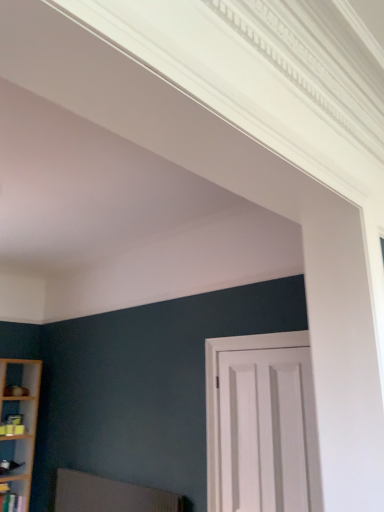
Question: Is white matte door at center at the left side of textured fabric swivel chair at lower left?

Choices:
 (A) no
 (B) yes

Answer: (A)

Question: Does white matte door at center have a lesser width compared to textured fabric swivel chair at lower left?

Choices:
 (A) yes
 (B) no

Answer: (A)

Question: Can you confirm if white matte door at center is wider than textured fabric swivel chair at lower left?

Choices:
 (A) no
 (B) yes

Answer: (A)

Question: Is white matte door at center turned away from textured fabric swivel chair at lower left?

Choices:
 (A) no
 (B) yes

Answer: (A)

Question: Is textured fabric swivel chair at lower left completely or partially inside white matte door at center?

Choices:
 (A) no
 (B) yes

Answer: (A)

Question: In the image, is white matte door at center positioned in front of or behind wooden shelf at lower left?

Choices:
 (A) front
 (B) behind

Answer: (A)

Question: Is point (233, 394) closer or farther from the camera than point (13, 494)?

Choices:
 (A) farther
 (B) closer

Answer: (B)

Question: Is white matte door at center taller or shorter than wooden shelf at lower left?

Choices:
 (A) short
 (B) tall

Answer: (B)

Question: Is white matte door at center to the left or to the right of wooden shelf at lower left in the image?

Choices:
 (A) right
 (B) left

Answer: (A)

Question: Relative to white matte door at center, is textured fabric swivel chair at lower left in front or behind?

Choices:
 (A) behind
 (B) front

Answer: (A)

Question: Looking at the image, does textured fabric swivel chair at lower left seem bigger or smaller compared to white matte door at center?

Choices:
 (A) big
 (B) small

Answer: (A)

Question: Considering the relative positions of textured fabric swivel chair at lower left and white matte door at center in the image provided, is textured fabric swivel chair at lower left to the left or to the right of white matte door at center?

Choices:
 (A) left
 (B) right

Answer: (A)

Question: From a real-world perspective, is textured fabric swivel chair at lower left positioned above or below white matte door at center?

Choices:
 (A) below
 (B) above

Answer: (A)

Question: Based on their positions, is white matte door at center located to the left or right of textured fabric swivel chair at lower left?

Choices:
 (A) right
 (B) left

Answer: (A)

Question: Is white matte door at center in front of or behind textured fabric swivel chair at lower left in the image?

Choices:
 (A) behind
 (B) front

Answer: (B)